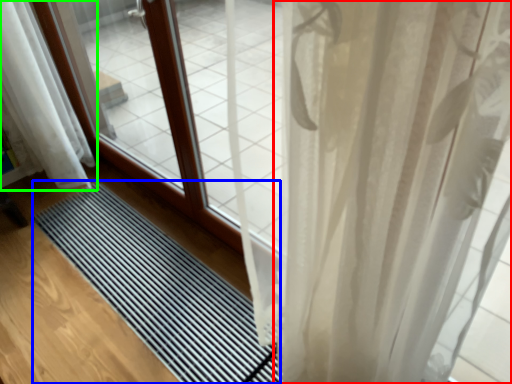
Question: Which object is positioned closest to curtain (highlighted by a red box)? Select from mat (highlighted by a blue box) and curtain (highlighted by a green box).

Choices:
 (A) mat
 (B) curtain

Answer: (A)